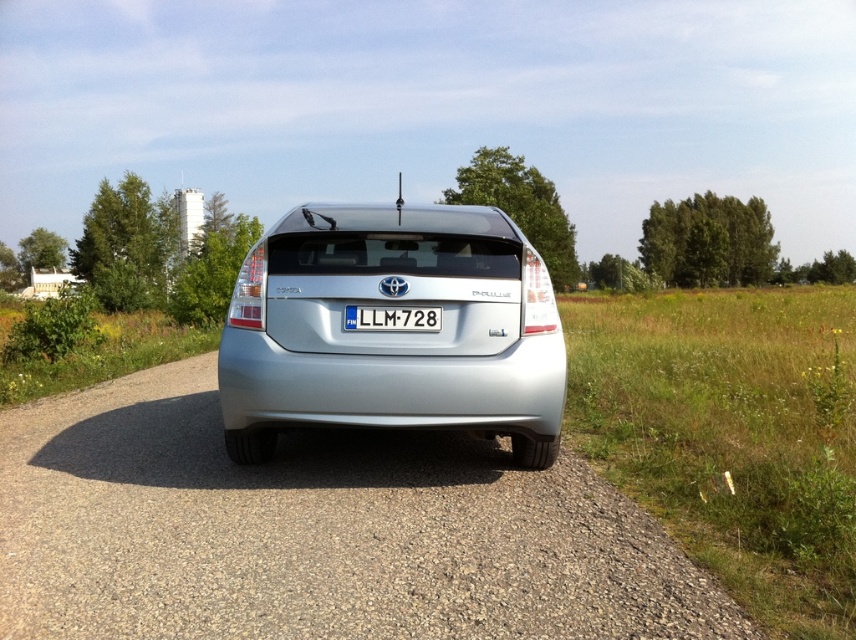
Is satin silver car at center above white plastic license plate at center?

Yes.

In the scene shown: Which is above, satin silver car at center or white plastic license plate at center?

Positioned higher is satin silver car at center.

Describe the element at coordinates (393, 332) in the screenshot. I see `satin silver car at center` at that location.

Where is `satin silver car at center`? The image size is (856, 640). satin silver car at center is located at coordinates (393, 332).